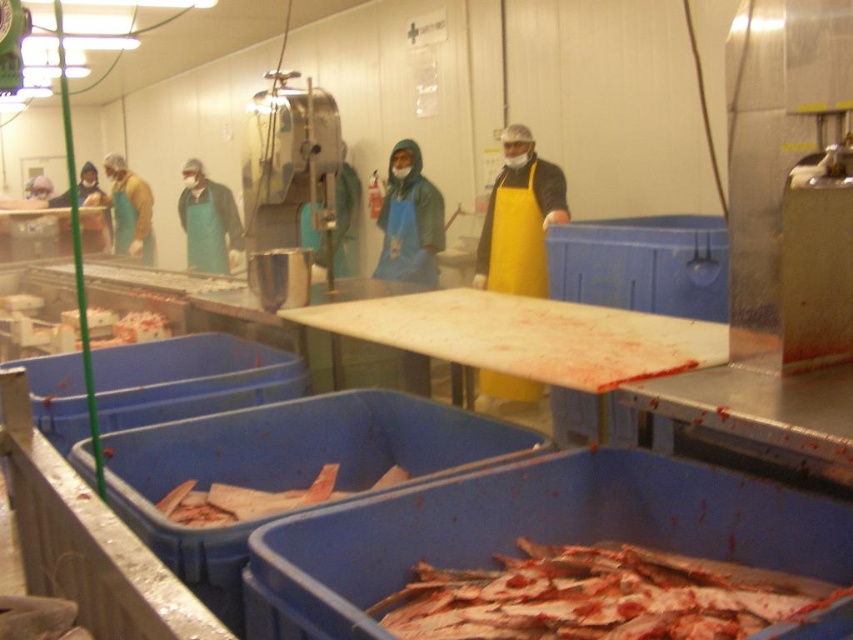
Question: Which point is closer to the camera taking this photo?

Choices:
 (A) (403, 202)
 (B) (105, 236)
 (C) (189, 182)
 (D) (505, 216)

Answer: (D)

Question: Which of the following is the farthest from the observer?

Choices:
 (A) pinkish flesh at lower left
 (B) yellow apron at center

Answer: (B)

Question: Is yellow apron at center to the left of green apron at center from the viewer's perspective?

Choices:
 (A) yes
 (B) no

Answer: (B)

Question: Considering the real-world distances, which object is farthest from the metallic silver machine at center?

Choices:
 (A) green apron at center
 (B) blue apron at left
 (C) pinkish flesh at lower left

Answer: (B)

Question: Does shiny silver fish at lower center have a lesser width compared to blue apron at left?

Choices:
 (A) no
 (B) yes

Answer: (A)

Question: Observing the image, what is the correct spatial positioning of yellow apron at center in reference to blue apron at center?

Choices:
 (A) above
 (B) below

Answer: (B)